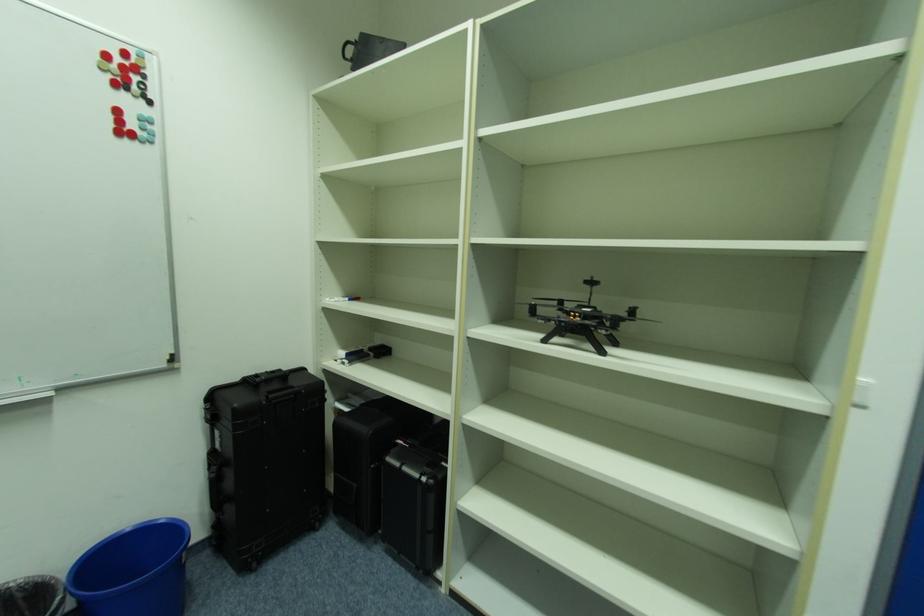
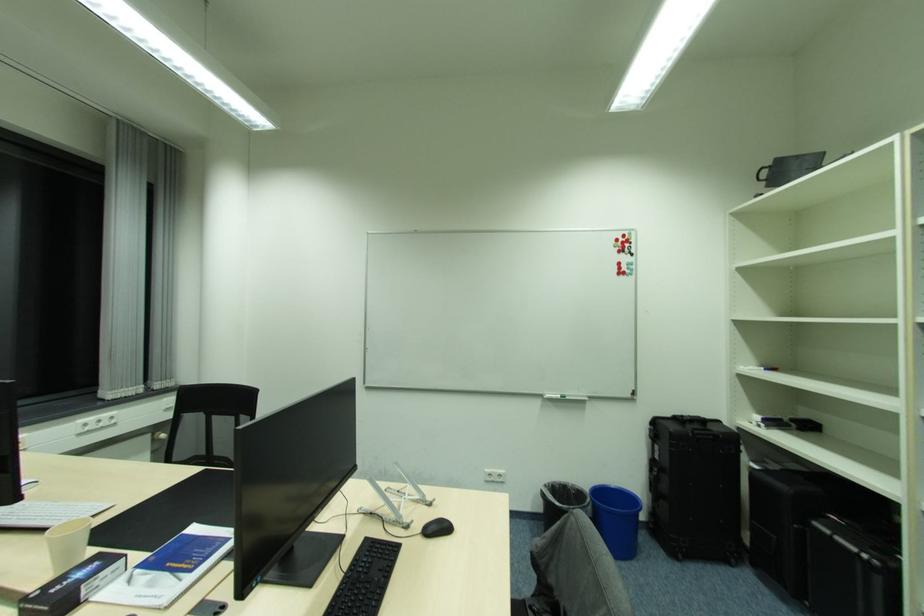
Question: The images are taken continuously from a first-person perspective. In which direction is your viewpoint rotating?

Choices:
 (A) Left
 (B) Right
 (C) Up
 (D) Down

Answer: (A)